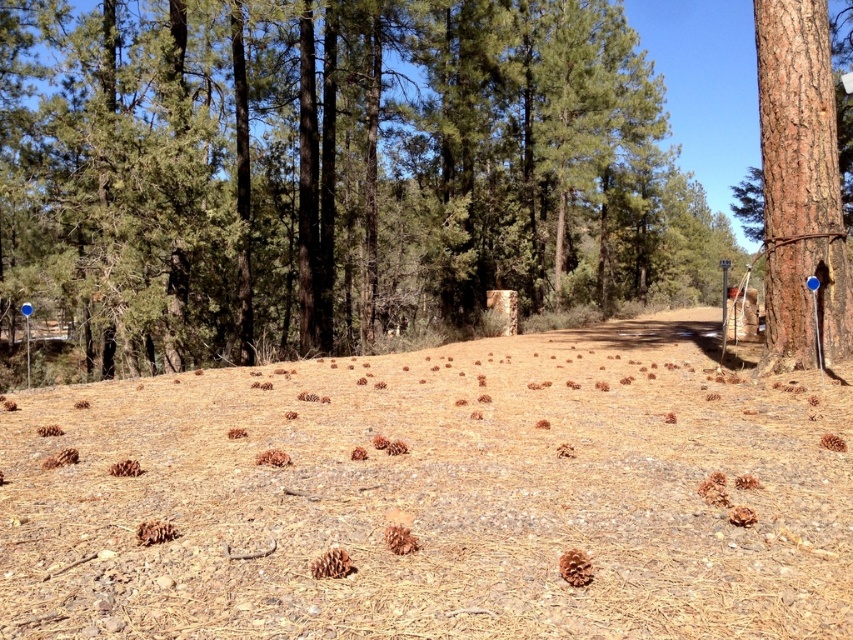
You are standing in the forest and see two points marked in the image. Which point is closer to you, point (575, 161) or point (767, 240)?

Point (575, 161) is further to the camera than point (767, 240), so point (767, 240) is closer to you.

You are a hiker trying to navigate through the forest. You see the green textured tree at center and the brown rough bark tree at right. Which tree would block your view more if you were standing between them?

The green textured tree at center is larger in size than the brown rough bark tree at right, so it would block your view more.